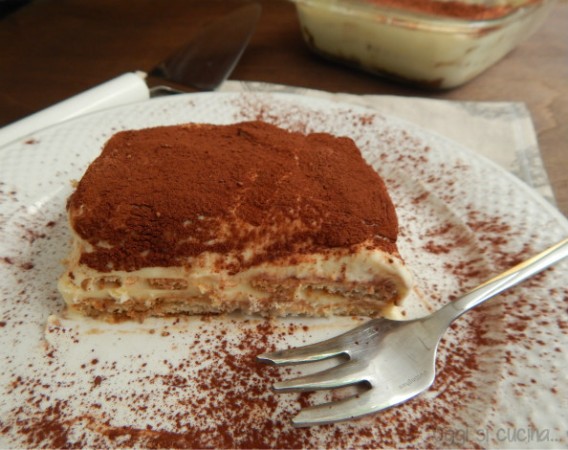
Where is `plate`? The width and height of the screenshot is (568, 450). plate is located at coordinates (523, 376).